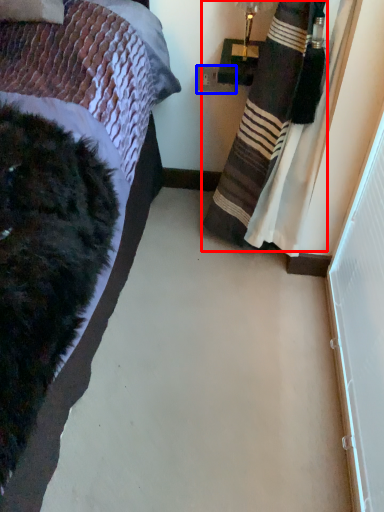
Question: Which point is further to the camera, curtain (highlighted by a red box) or power outlet (highlighted by a blue box)?

Choices:
 (A) curtain
 (B) power outlet

Answer: (B)